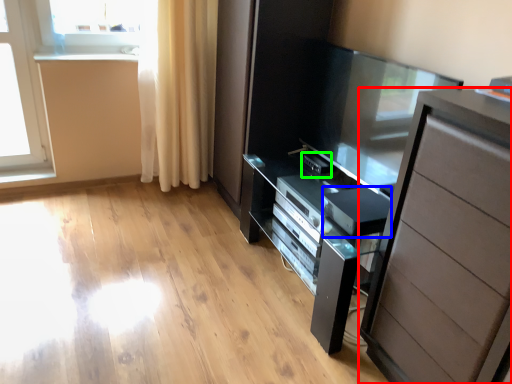
Question: Considering the real-world distances, which object is farthest from chest of drawers (highlighted by a red box)? appliance (highlighted by a blue box) or appliance (highlighted by a green box)?

Choices:
 (A) appliance
 (B) appliance

Answer: (B)